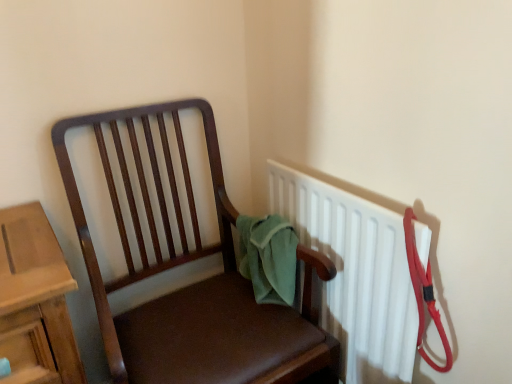
Question: From their relative heights in the image, would you say matte brown chair at center is taller or shorter than white plastic radiator at upper right?

Choices:
 (A) tall
 (B) short

Answer: (A)

Question: From the image's perspective, is matte brown chair at center located above or below white plastic radiator at upper right?

Choices:
 (A) below
 (B) above

Answer: (A)

Question: Does point (227, 360) appear closer or farther from the camera than point (356, 276)?

Choices:
 (A) farther
 (B) closer

Answer: (B)

Question: Is point (305, 208) positioned closer to the camera than point (248, 332)?

Choices:
 (A) farther
 (B) closer

Answer: (A)

Question: Would you say white plastic radiator at upper right is to the left or to the right of matte brown chair at center in the picture?

Choices:
 (A) right
 (B) left

Answer: (A)

Question: Looking at their shapes, would you say white plastic radiator at upper right is wider or thinner than matte brown chair at center?

Choices:
 (A) thin
 (B) wide

Answer: (A)

Question: In the image, is white plastic radiator at upper right positioned in front of or behind matte brown chair at center?

Choices:
 (A) behind
 (B) front

Answer: (A)